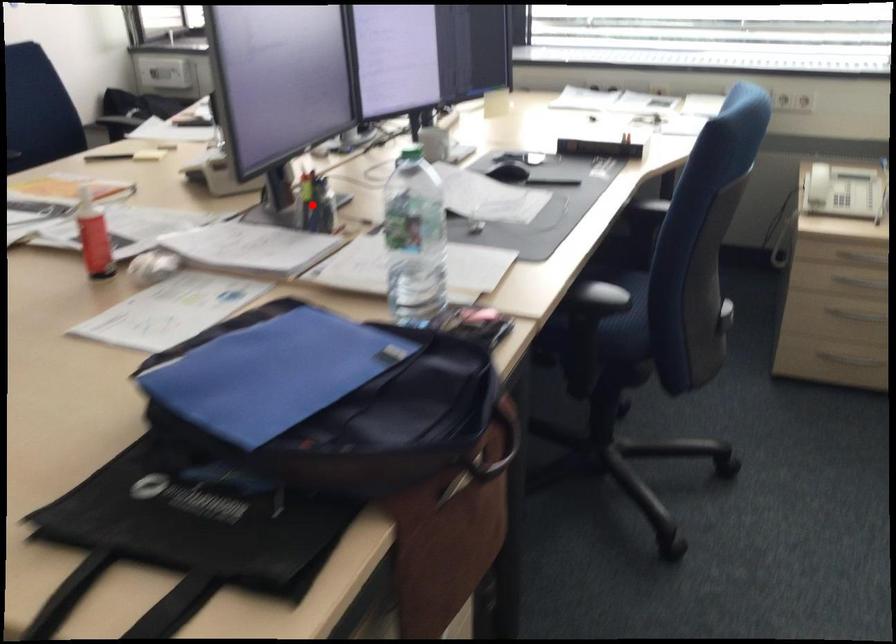
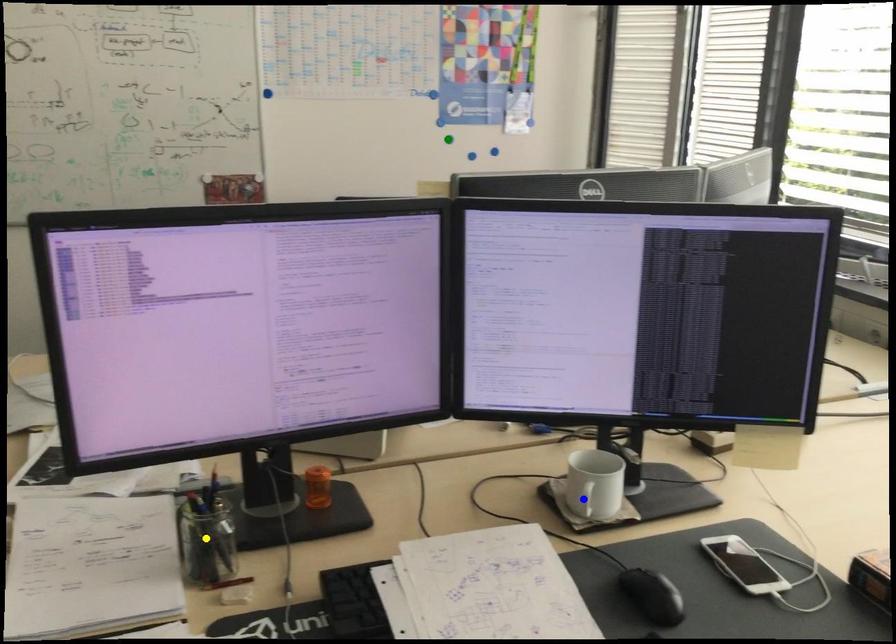
Question: I am providing you with two images of the same scene from different viewpoints. A red point is marked on the first image. You are given multiple points on the second image. Which point in image 2 represents the same 3d spot as the red point in image 1?

Choices:
 (A) yellow point
 (B) green point
 (C) blue point

Answer: (A)